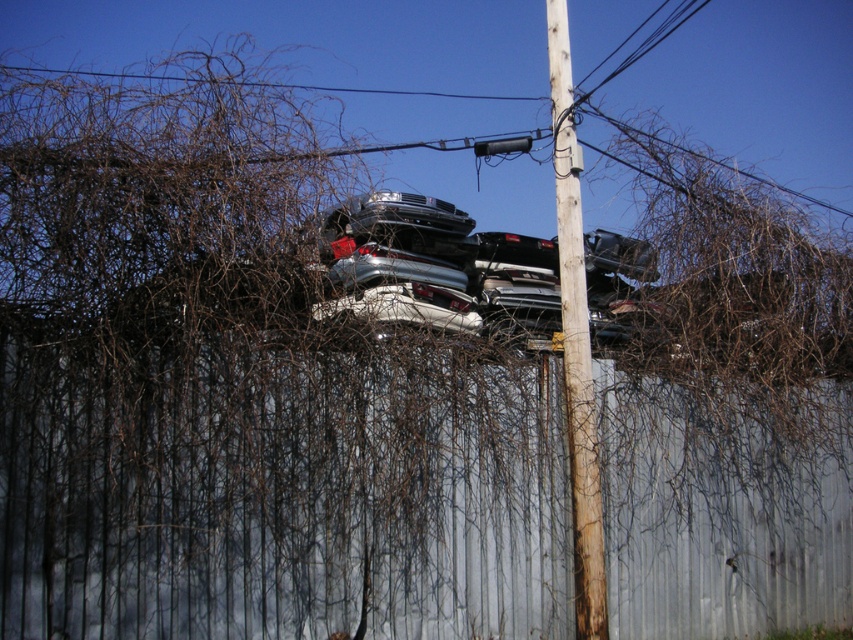
Question: Among these objects, which one is nearest to the camera?

Choices:
 (A) metallic gray fence at upper center
 (B) wooden telephone pole at center

Answer: (A)

Question: Where is metallic gray fence at upper center located in relation to wooden telephone pole at center in the image?

Choices:
 (A) left
 (B) right

Answer: (A)

Question: Which point is farther to the camera?

Choices:
 (A) (486, 301)
 (B) (552, 124)
 (C) (340, 396)

Answer: (A)

Question: Is metallic gray fence at upper center to the right of shiny silver car at center from the viewer's perspective?

Choices:
 (A) no
 (B) yes

Answer: (A)

Question: Does silver metallic car at center lie behind wooden telephone pole at center?

Choices:
 (A) no
 (B) yes

Answer: (A)

Question: Which point is farther from the camera taking this photo?

Choices:
 (A) (577, 522)
 (B) (438, 289)
 (C) (345, 269)

Answer: (B)